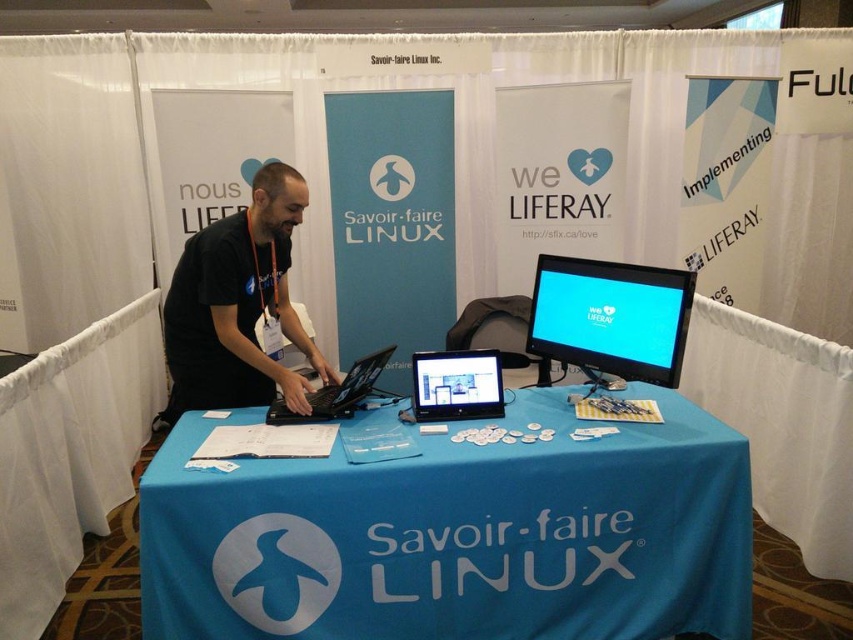
You are a visitor at the conference and want to place a business card on the table. Where should you place it so that it is visible over the blue fabric tablecloth at center and the black matte laptop at center?

The blue fabric tablecloth at center is in front of the black matte laptop at center, so placing the business card on the table behind the blue fabric tablecloth at center would make it visible over both objects.

You are standing at the booth and want to place a new item at point (611, 497). The existing items are already placed at point (364, 381). Which point is closer to you?

Point (611, 497) is in front of point (364, 381), so it is closer to you.

You are standing in front of the Savoir Linux booth and need to place a new banner between the two points marked as point (608, 308) and point (338, 404). Which point should the banner be closer to in order to be more visible to people walking by?

The banner should be placed closer to point (608, 308) because it is closer to the viewer, making it more visible to people walking by.